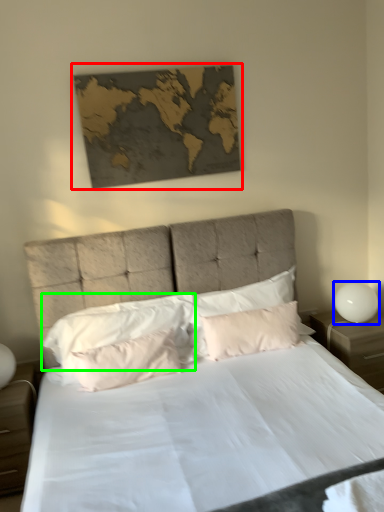
Question: Considering the real-world distances, which object is farthest from picture frame (highlighted by a red box)? bedside lamp (highlighted by a blue box) or pillow (highlighted by a green box)?

Choices:
 (A) bedside lamp
 (B) pillow

Answer: (A)